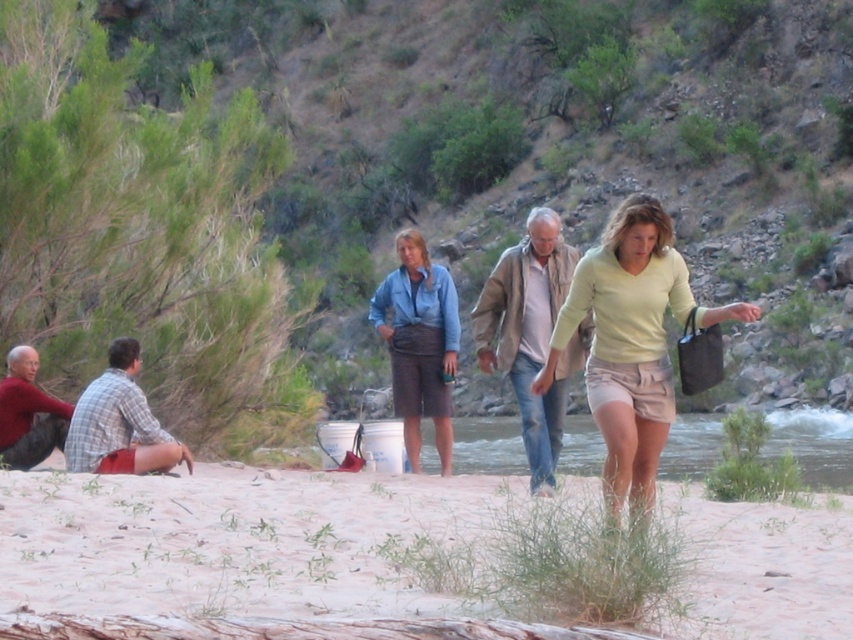
Consider the image. Which is more to the right, light yellow fabric skirt at center or matte blue shirt at center?

light yellow fabric skirt at center

Who is more distant from viewer, [653,305] or [405,394]?

Positioned behind is point [405,394].

Where is `light yellow fabric skirt at center`? The image size is (853, 640). light yellow fabric skirt at center is located at coordinates (631, 342).

Between light beige sand at lower center and light brown leather jacket at center, which one has more height?

light brown leather jacket at center

Does point (254, 515) lie in front of point (579, 365)?

Yes, it is.

Who is more forward, (469, 476) or (502, 330)?

Point (502, 330)

Image resolution: width=853 pixels, height=640 pixels. Find the location of `light beige sand at lower center`. light beige sand at lower center is located at coordinates (231, 541).

Between light beige sand at lower center and matte blue shirt at center, which one appears on the left side from the viewer's perspective?

matte blue shirt at center is more to the left.

Does point (230, 609) lie behind point (410, 324)?

That is False.

I want to click on light beige sand at lower center, so (231, 541).

The height and width of the screenshot is (640, 853). What are the coordinates of `light beige sand at lower center` in the screenshot? It's located at (231, 541).